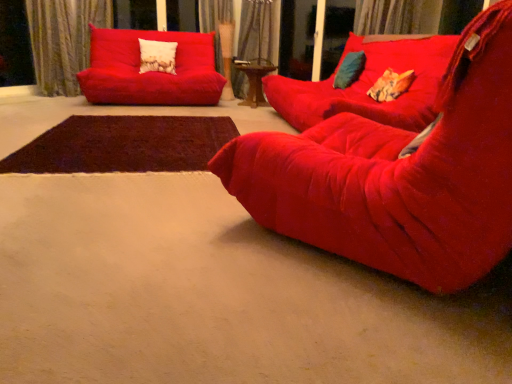
Question: From a real-world perspective, is velvet curtain at upper left, which appears as the 1th curtain when viewed from the left, positioned under velvet textured pillow at upper center, which appears as the 3th pillow when viewed from the front, based on gravity?

Choices:
 (A) no
 (B) yes

Answer: (A)

Question: Can you confirm if velvet curtain at upper left, which appears as the 1th curtain when viewed from the left, is positioned to the left of velvet textured pillow at upper center, which is the first pillow in top-to-bottom order?

Choices:
 (A) yes
 (B) no

Answer: (A)

Question: From a real-world perspective, is velvet curtain at upper left, which appears as the third curtain when viewed from the right, positioned over velvet textured pillow at upper center, the 3th pillow from the right, based on gravity?

Choices:
 (A) yes
 (B) no

Answer: (A)

Question: Is velvet curtain at upper left, which appears as the third curtain when viewed from the right, aimed at velvet textured pillow at upper center, which is the first pillow in left-to-right order?

Choices:
 (A) yes
 (B) no

Answer: (B)

Question: Is velvet curtain at upper left, which appears as the 1th curtain when viewed from the left, positioned beyond the bounds of velvet textured pillow at upper center, the 3th pillow from the right?

Choices:
 (A) yes
 (B) no

Answer: (A)

Question: Is velvet curtain at upper left, which appears as the 1th curtain when viewed from the left, in front of velvet textured pillow at upper center, which is the first pillow in top-to-bottom order?

Choices:
 (A) yes
 (B) no

Answer: (A)

Question: Is matte red studio couch at upper left, marked as the 1th studio couch in a back-to-front arrangement, further to the viewer compared to velvet red studio couch at center, placed as the 2th studio couch when sorted from back to front?

Choices:
 (A) yes
 (B) no

Answer: (A)

Question: Is matte red studio couch at upper left, marked as the 1th studio couch in a back-to-front arrangement, positioned in front of velvet red studio couch at center, which ranks as the 2th studio couch in front-to-back order?

Choices:
 (A) no
 (B) yes

Answer: (A)

Question: Is matte red studio couch at upper left, marked as the 3th studio couch in a front-to-back arrangement, facing towards velvet red studio couch at center, which ranks as the 2th studio couch in front-to-back order?

Choices:
 (A) yes
 (B) no

Answer: (B)

Question: Could velvet red studio couch at center, placed as the 2th studio couch when sorted from back to front, be considered to be inside matte red studio couch at upper left, marked as the 1th studio couch in a back-to-front arrangement?

Choices:
 (A) yes
 (B) no

Answer: (B)

Question: Is matte red studio couch at upper left, marked as the 1th studio couch in a back-to-front arrangement, shorter than velvet red studio couch at center, which ranks as the 2th studio couch in front-to-back order?

Choices:
 (A) no
 (B) yes

Answer: (B)

Question: Is there a large distance between matte red studio couch at upper left, marked as the 1th studio couch in a back-to-front arrangement, and velvet red studio couch at center, which ranks as the 2th studio couch in front-to-back order?

Choices:
 (A) yes
 (B) no

Answer: (A)

Question: From the image's perspective, is orange fabric pillow at center, which is the 1th pillow from bottom to top, on velvet textured pillow at upper center, which is the first pillow in left-to-right order?

Choices:
 (A) no
 (B) yes

Answer: (A)